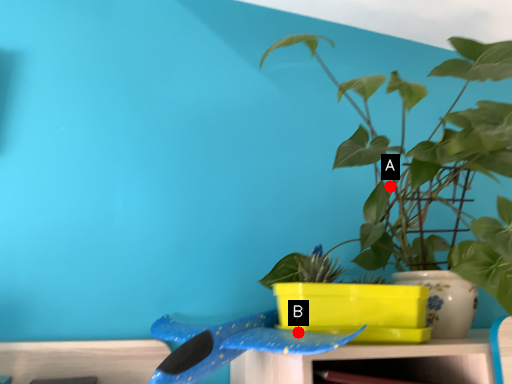
Question: Two points are circled on the image, labeled by A and B beside each circle. Among these points, which one is nearest to the camera?

Choices:
 (A) A is closer
 (B) B is closer

Answer: (B)